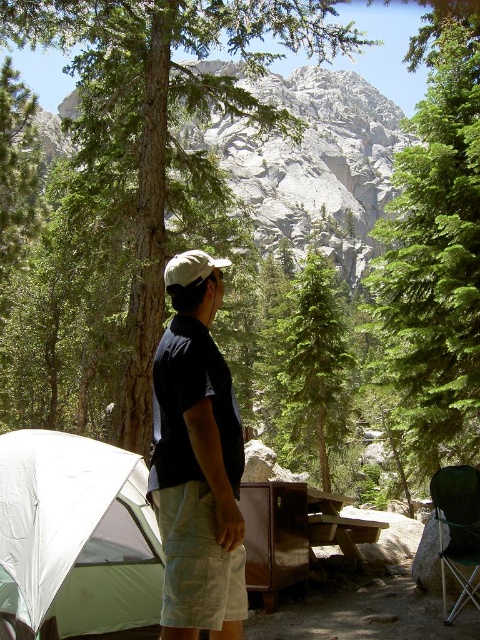
Between point (37, 467) and point (305, 417), which one is positioned behind?

Point (305, 417)

This screenshot has width=480, height=640. I want to click on white fabric tent at lower left, so click(x=75, y=536).

Does gray rock mountain at upper center appear under metallic folding chair at lower right?

Actually, gray rock mountain at upper center is above metallic folding chair at lower right.

Identify the location of gray rock mountain at upper center. (312, 163).

Locate an element on the screen. Image resolution: width=480 pixels, height=640 pixels. gray rock mountain at upper center is located at coordinates (312, 163).

Locate an element on the screen. gray rock mountain at upper center is located at coordinates (312, 163).

Is metallic folding chair at lower right taller than khaki fabric baseball cap at center?

Yes, metallic folding chair at lower right is taller than khaki fabric baseball cap at center.

Looking at this image, can you confirm if metallic folding chair at lower right is smaller than khaki fabric baseball cap at center?

Yes, metallic folding chair at lower right is smaller than khaki fabric baseball cap at center.

Find the location of a particular element. The height and width of the screenshot is (640, 480). metallic folding chair at lower right is located at coordinates (457, 531).

Image resolution: width=480 pixels, height=640 pixels. I want to click on metallic folding chair at lower right, so click(x=457, y=531).